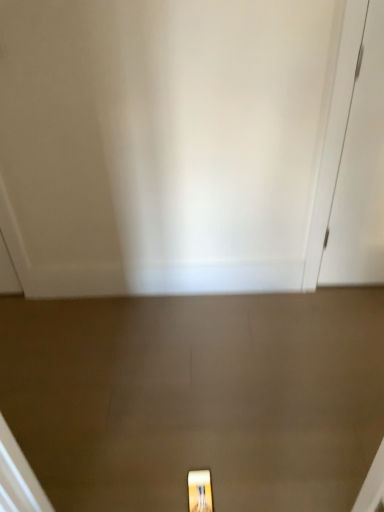
What do you see at coordinates (171, 142) in the screenshot?
I see `white glossy door at center, acting as the 2th door starting from the right` at bounding box center [171, 142].

What do you see at coordinates (200, 490) in the screenshot? I see `matte gold light fixture at lower center` at bounding box center [200, 490].

Locate an element on the screen. This screenshot has width=384, height=512. white glossy door at center, which ranks as the 2th door in back-to-front order is located at coordinates (171, 142).

Is white matte door at right, marked as the second door in a left-to-right arrangement, positioned far away from matte gold light fixture at lower center?

That's right, there is a large distance between white matte door at right, marked as the second door in a left-to-right arrangement, and matte gold light fixture at lower center.

From a real-world perspective, which object stands above the other?

In real-world perspective, white matte door at right, placed as the 1th door when sorted from back to front, is above.

Looking at this image, which object is positioned more to the right, white matte door at right, marked as the second door in a left-to-right arrangement, or matte gold light fixture at lower center?

white matte door at right, marked as the second door in a left-to-right arrangement.

Who is bigger, white matte door at right, which is the first door in right-to-left order, or matte gold light fixture at lower center?

With larger size is white matte door at right, which is the first door in right-to-left order.

Is white matte door at right, which is the first door in right-to-left order, not close to white glossy door at center, acting as the 2th door starting from the right?

That's not correct — white matte door at right, which is the first door in right-to-left order, is a little close to white glossy door at center, acting as the 2th door starting from the right.

Which of these two, white matte door at right, placed as the 1th door when sorted from back to front, or white glossy door at center, which ranks as the 2th door in back-to-front order, stands shorter?

white matte door at right, placed as the 1th door when sorted from back to front.

Is point (357, 251) more distant than point (128, 6)?

Yes, point (357, 251) is behind point (128, 6).

In the scene shown: Is white matte door at right, which is counted as the second door, starting from the front, not inside white glossy door at center, acting as the 2th door starting from the right?

Indeed, white matte door at right, which is counted as the second door, starting from the front, is completely outside white glossy door at center, acting as the 2th door starting from the right.

How much distance is there between white glossy door at center, which is the 1th door from front to back, and white matte door at right, which is counted as the second door, starting from the front?

white glossy door at center, which is the 1th door from front to back, is 21.33 inches away from white matte door at right, which is counted as the second door, starting from the front.

Does point (237, 48) come in front of point (355, 87)?

Yes, point (237, 48) is in front of point (355, 87).

Find the location of `door on the right of white glossy door at center, which ranks as the 2th door in back-to-front order`. door on the right of white glossy door at center, which ranks as the 2th door in back-to-front order is located at coordinates (361, 172).

In terms of width, does white glossy door at center, which is the 1th door from front to back, look wider or thinner when compared to white matte door at right, which is counted as the second door, starting from the front?

white glossy door at center, which is the 1th door from front to back, is wider than white matte door at right, which is counted as the second door, starting from the front.

Which of these two, matte gold light fixture at lower center or white matte door at right, which is the first door in right-to-left order, is bigger?

Bigger between the two is white matte door at right, which is the first door in right-to-left order.

Based on their positions, is matte gold light fixture at lower center located to the left or right of white matte door at right, placed as the 1th door when sorted from back to front?

From the image, it's evident that matte gold light fixture at lower center is to the left of white matte door at right, placed as the 1th door when sorted from back to front.

Could you tell me if matte gold light fixture at lower center is turned towards white matte door at right, which is the first door in right-to-left order?

No, matte gold light fixture at lower center is not facing towards white matte door at right, which is the first door in right-to-left order.

Consider the image. Is matte gold light fixture at lower center thinner than white glossy door at center, which is the 1th door from front to back?

Yes.

Between point (200, 503) and point (246, 184), which one is positioned behind?

Positioned behind is point (246, 184).

Is matte gold light fixture at lower center far from white glossy door at center, which ranks as the 2th door in back-to-front order?

matte gold light fixture at lower center is far away from white glossy door at center, which ranks as the 2th door in back-to-front order.

Does white glossy door at center, which ranks as the 2th door in back-to-front order, have a larger size compared to matte gold light fixture at lower center?

Yes, white glossy door at center, which ranks as the 2th door in back-to-front order, is bigger than matte gold light fixture at lower center.

Considering their positions, is white glossy door at center, which is the 1th door from left to right, located in front of or behind matte gold light fixture at lower center?

white glossy door at center, which is the 1th door from left to right, is positioned closer to the viewer than matte gold light fixture at lower center.

Is white glossy door at center, acting as the 2th door starting from the right, inside the boundaries of matte gold light fixture at lower center, or outside?

white glossy door at center, acting as the 2th door starting from the right, is outside matte gold light fixture at lower center.

Locate an element on the screen. This screenshot has width=384, height=512. light fixture on the left of white matte door at right, which is counted as the second door, starting from the front is located at coordinates (200, 490).

The width and height of the screenshot is (384, 512). Identify the location of door above the white matte door at right, which is counted as the second door, starting from the front (from a real-world perspective). (171, 142).

Looking at the image, which one is located further to white glossy door at center, which is the 1th door from left to right, matte gold light fixture at lower center or white matte door at right, which is counted as the second door, starting from the front?

Among the two, matte gold light fixture at lower center is located further to white glossy door at center, which is the 1th door from left to right.

From the image, which object appears to be nearer to white matte door at right, which is the first door in right-to-left order, white glossy door at center, which is the 1th door from front to back, or matte gold light fixture at lower center?

The object closer to white matte door at right, which is the first door in right-to-left order, is white glossy door at center, which is the 1th door from front to back.

Estimate the real-world distances between objects in this image. Which object is further from white glossy door at center, which ranks as the 2th door in back-to-front order, white matte door at right, which is the first door in right-to-left order, or matte gold light fixture at lower center?

matte gold light fixture at lower center.

Which object lies nearer to the anchor point white matte door at right, which is the first door in right-to-left order, matte gold light fixture at lower center or white glossy door at center, which is the 1th door from front to back?

white glossy door at center, which is the 1th door from front to back, is closer to white matte door at right, which is the first door in right-to-left order.

Estimate the real-world distances between objects in this image. Which object is closer to matte gold light fixture at lower center, white matte door at right, placed as the 1th door when sorted from back to front, or white glossy door at center, which is the 1th door from front to back?

white glossy door at center, which is the 1th door from front to back.

From the image, which object appears to be farther from matte gold light fixture at lower center, white glossy door at center, which is the 1th door from left to right, or white matte door at right, marked as the second door in a left-to-right arrangement?

white matte door at right, marked as the second door in a left-to-right arrangement, lies further to matte gold light fixture at lower center than the other object.

Where is `light fixture between white glossy door at center, which ranks as the 2th door in back-to-front order, and white matte door at right, placed as the 1th door when sorted from back to front, along the z-axis`? The height and width of the screenshot is (512, 384). light fixture between white glossy door at center, which ranks as the 2th door in back-to-front order, and white matte door at right, placed as the 1th door when sorted from back to front, along the z-axis is located at coordinates (200, 490).